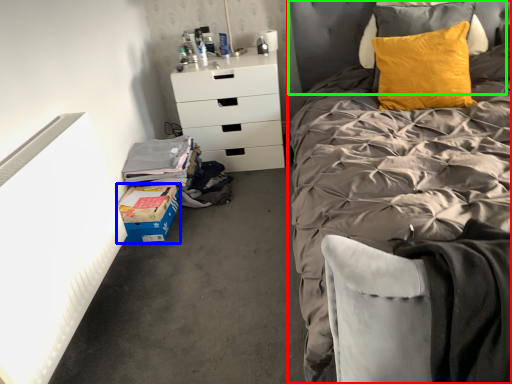
Question: Based on their relative distances, which object is farther from bed (highlighted by a red box)? Choose from cardboard box (highlighted by a blue box) and headboard (highlighted by a green box).

Choices:
 (A) cardboard box
 (B) headboard

Answer: (A)